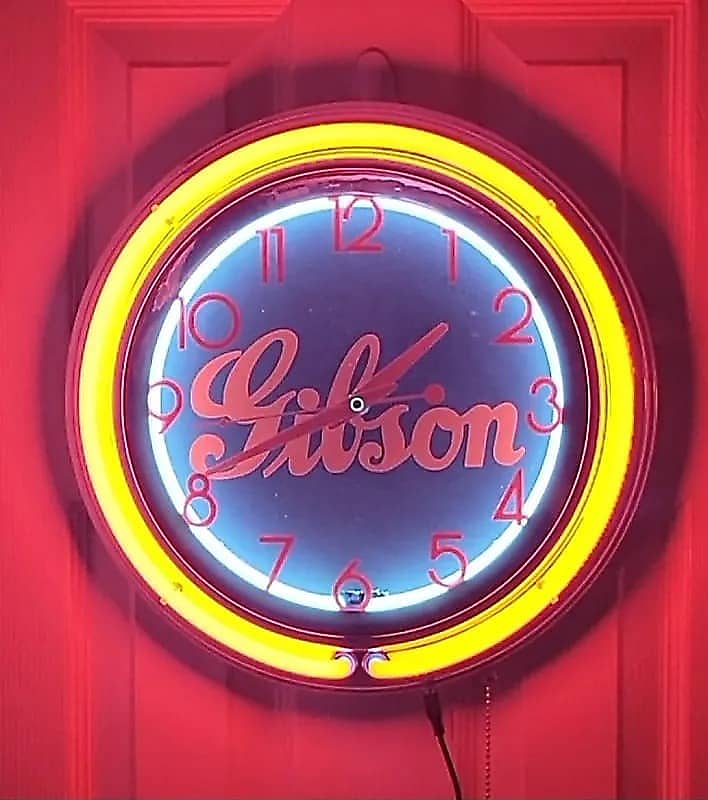
You are a GUI agent. You are given a task and a screenshot of the screen. Output one action in this format:
    pyautogui.click(x=<x>, y=<y>)
    Task: Click on the red wall
    
    Given the screenshot: What is the action you would take?
    pyautogui.click(x=188, y=729)